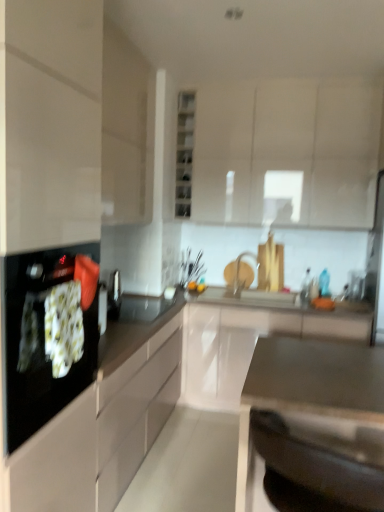
Question: Considering the positions of point (326, 407) and point (168, 327), is point (326, 407) closer or farther from the camera than point (168, 327)?

Choices:
 (A) closer
 (B) farther

Answer: (A)

Question: In terms of width, does satin metallic sink at lower center, the first countertop in the front-to-back sequence, look wider or thinner when compared to black glossy countertop at center, placed as the second countertop when sorted from front to back?

Choices:
 (A) thin
 (B) wide

Answer: (A)

Question: Estimate the real-world distances between objects in this image. Which object is farther from the white glossy cabinet at upper center, which is the 3th cabinetry in bottom-to-top order?

Choices:
 (A) white glossy cabinet at center, the 1th cabinetry positioned from the bottom
 (B) black glossy countertop at center, positioned as the first countertop in back-to-front order
 (C) satin metallic sink at lower center, which is the second countertop from back to front
 (D) black glass cooktop at left
 (E) transparent glass shelves at center

Answer: (D)

Question: Based on their relative distances, which object is nearer to the white glossy cabinet at upper center, which is the 3th cabinetry in bottom-to-top order?

Choices:
 (A) transparent glass shelves at center
 (B) black glossy countertop at center, placed as the second countertop when sorted from front to back
 (C) white glossy cabinet at center, placed as the third cabinetry when sorted from top to bottom
 (D) satin metallic sink at lower center, the first countertop in the front-to-back sequence
 (E) black glass cooktop at left

Answer: (A)